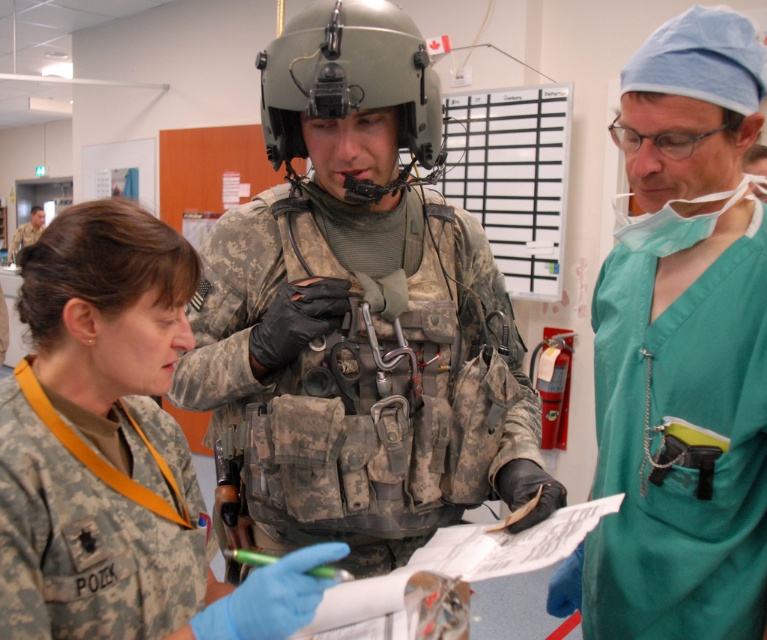
In the scene shown: You are a military trainee observing the scene. You need to determine if the camouflage uniform at center can be fully covered by the matte gray helmet at center. Based on their sizes, what do you think?

The camouflage uniform at center might be wider than matte gray helmet at center, so the helmet cannot fully cover the uniform.

You are a medical orderly in the facility and need to locate the green scrubs at right and the matte gray helmet at center. From your vantage point, which object is lower in position?

The green scrubs at right is positioned under the matte gray helmet at center, so the green scrubs at right is lower in position.

You are a military trainee observing the scene. There are two points marked in the image. The first point is at coordinate point (693,305) and the second point is at coordinate point (160,481). From your perspective, which point is closer to you?

Point (160,481) is closer to you because point (693,305) is behind it.